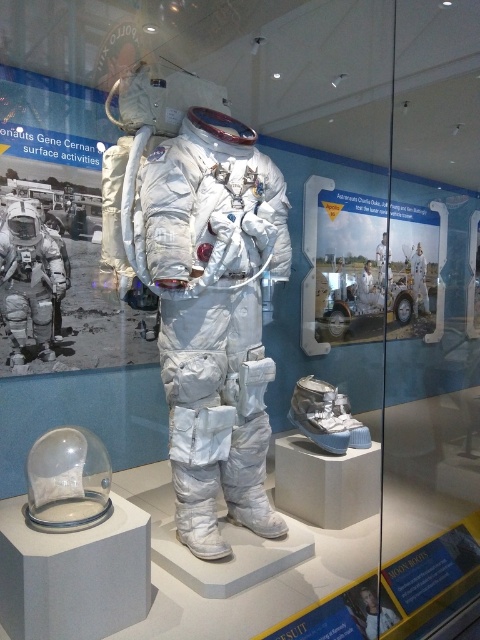
You are a museum visitor standing in front of the space suit exhibit. You see the matte white spacesuit at center and the white matte spacesuit at center. Which one is closer to you?

The matte white spacesuit at center is closer to you because it is in front of the white matte spacesuit at center.

You are a museum curator planning to move the white metallic spacesuit at center and the white matte spacesuit at center to a new exhibition space. The doorway you need to use has a width of 1.2 meters. Based on the current display, can both suits pass through the doorway without rotating them?

The white metallic spacesuit at center might be wider than white matte spacesuit at center, so it is uncertain if both can pass through the 1.2 meter doorway without rotating them. The curator should measure the widest part of both suits to confirm.